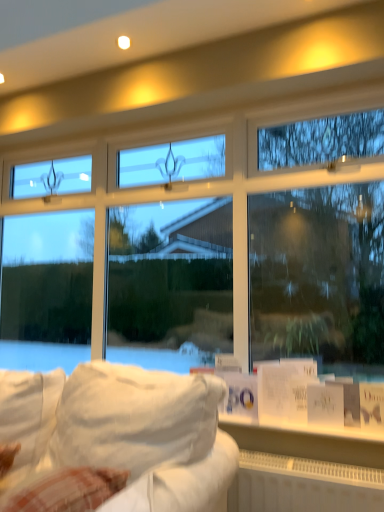
The height and width of the screenshot is (512, 384). Describe the element at coordinates (115, 440) in the screenshot. I see `white fabric couch at lower left` at that location.

Where is `white fabric couch at lower left`? white fabric couch at lower left is located at coordinates [x=115, y=440].

Find the location of a particular element. white plastic radiator at lower center is located at coordinates (303, 485).

What do you see at coordinates (303, 485) in the screenshot?
I see `white plastic radiator at lower center` at bounding box center [303, 485].

What is the approximate height of white plastic radiator at lower center?

The height of white plastic radiator at lower center is 9.51 inches.

This screenshot has width=384, height=512. Identify the location of white fabric couch at lower left. click(x=115, y=440).

Does white plastic radiator at lower center appear on the right side of white fabric couch at lower left?

Indeed, white plastic radiator at lower center is positioned on the right side of white fabric couch at lower left.

Relative to white fabric couch at lower left, is white plastic radiator at lower center in front or behind?

In the image, white plastic radiator at lower center appears behind white fabric couch at lower left.

Does point (236, 484) lie in front of point (204, 490)?

No.

From the image's perspective, does white plastic radiator at lower center appear lower than white fabric couch at lower left?

Correct, white plastic radiator at lower center appears lower than white fabric couch at lower left in the image.

From a real-world perspective, is white plastic radiator at lower center on top of white fabric couch at lower left?

No, from a real-world perspective, white plastic radiator at lower center is not on top of white fabric couch at lower left.

From the picture: Which object is wider, white plastic radiator at lower center or white fabric couch at lower left?

white fabric couch at lower left is wider.

Which of these two, white plastic radiator at lower center or white fabric couch at lower left, stands shorter?

white plastic radiator at lower center is shorter.

Between white plastic radiator at lower center and white fabric couch at lower left, which one has smaller size?

With smaller size is white plastic radiator at lower center.

Could white fabric couch at lower left be considered to be inside white plastic radiator at lower center?

No, white fabric couch at lower left is not a part of white plastic radiator at lower center.

Are white plastic radiator at lower center and white fabric couch at lower left beside each other?

white plastic radiator at lower center and white fabric couch at lower left are clearly separated.

Is white plastic radiator at lower center oriented away from white fabric couch at lower left?

white plastic radiator at lower center is not turned away from white fabric couch at lower left.

This screenshot has width=384, height=512. Find the location of `radiator that is behind the white fabric couch at lower left`. radiator that is behind the white fabric couch at lower left is located at coordinates (303, 485).

Looking at this image, is white fabric couch at lower left at the left side of white plastic radiator at lower center?

Correct, you'll find white fabric couch at lower left to the left of white plastic radiator at lower center.

Considering the positions of objects white fabric couch at lower left and white plastic radiator at lower center in the image provided, who is behind, white fabric couch at lower left or white plastic radiator at lower center?

Positioned behind is white plastic radiator at lower center.

Does point (135, 375) come behind point (310, 475)?

Yes, it is behind point (310, 475).

From the image's perspective, does white fabric couch at lower left appear lower than white plastic radiator at lower center?

No, from the image's perspective, white fabric couch at lower left is not below white plastic radiator at lower center.

From a real-world perspective, is white fabric couch at lower left over white plastic radiator at lower center?

Yes, from a real-world perspective, white fabric couch at lower left is over white plastic radiator at lower center

Is white fabric couch at lower left wider or thinner than white plastic radiator at lower center?

white fabric couch at lower left is wider than white plastic radiator at lower center.

In terms of height, does white fabric couch at lower left look taller or shorter compared to white plastic radiator at lower center?

Clearly, white fabric couch at lower left is taller compared to white plastic radiator at lower center.

Considering the sizes of objects white fabric couch at lower left and white plastic radiator at lower center in the image provided, who is bigger, white fabric couch at lower left or white plastic radiator at lower center?

white fabric couch at lower left is bigger.

Could white plastic radiator at lower center be considered to be inside white fabric couch at lower left?

That's incorrect, white plastic radiator at lower center is not inside white fabric couch at lower left.

Are white fabric couch at lower left and white plastic radiator at lower center located far from each other?

No, white fabric couch at lower left is in close proximity to white plastic radiator at lower center.

Is white plastic radiator at lower center at the back of white fabric couch at lower left?

No, white plastic radiator at lower center is not at the back of white fabric couch at lower left.

Locate an element on the screen. The width and height of the screenshot is (384, 512). studio couch to the left of white plastic radiator at lower center is located at coordinates (115, 440).

Image resolution: width=384 pixels, height=512 pixels. In order to click on studio couch that is in front of the white plastic radiator at lower center in this screenshot , I will do `click(115, 440)`.

Locate an element on the screen. The width and height of the screenshot is (384, 512). radiator behind the white fabric couch at lower left is located at coordinates (303, 485).